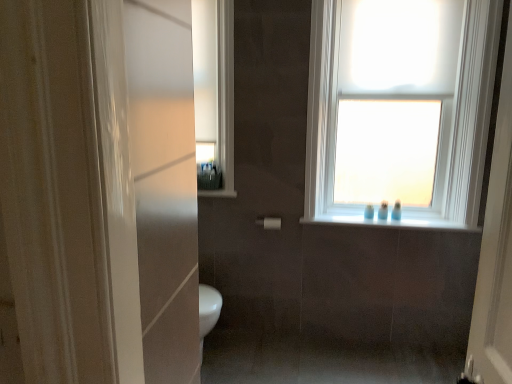
In order to click on vacant space to the right of blue glossy toothbrush at upper right, the 4th toiletry positioned from the left in this screenshot , I will do `click(423, 221)`.